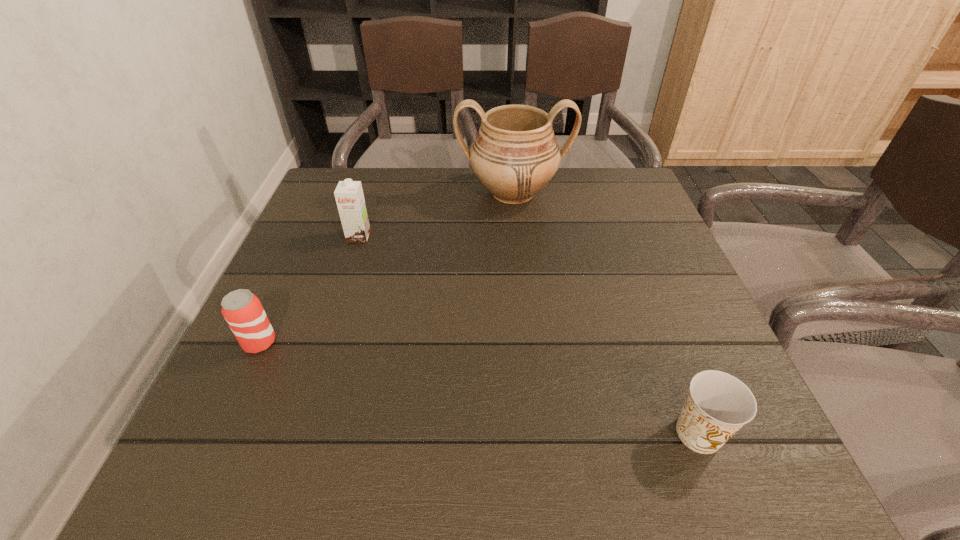
Locate an element on the screen. This screenshot has width=960, height=540. vacant area situated 0.090m on the back of the leftmost object is located at coordinates (281, 295).

Where is `vacant space situated 0.330m on the left of the rightmost object`? vacant space situated 0.330m on the left of the rightmost object is located at coordinates (451, 434).

Where is `object that is at the far edge`? The height and width of the screenshot is (540, 960). object that is at the far edge is located at coordinates tap(515, 154).

Image resolution: width=960 pixels, height=540 pixels. Find the location of `object that is at the near edge`. object that is at the near edge is located at coordinates (x=718, y=404).

Identify the location of chocolate milk located at the left edge. (349, 196).

The width and height of the screenshot is (960, 540). What are the coordinates of `beer can situated at the left edge` in the screenshot? It's located at (242, 310).

The width and height of the screenshot is (960, 540). Find the location of `object that is at the right edge`. object that is at the right edge is located at coordinates (718, 404).

Identify the location of object that is at the near right corner. (718, 404).

Locate an element on the screen. vacant region at the far edge is located at coordinates (424, 174).

I want to click on vacant space at the near edge of the desktop, so click(628, 435).